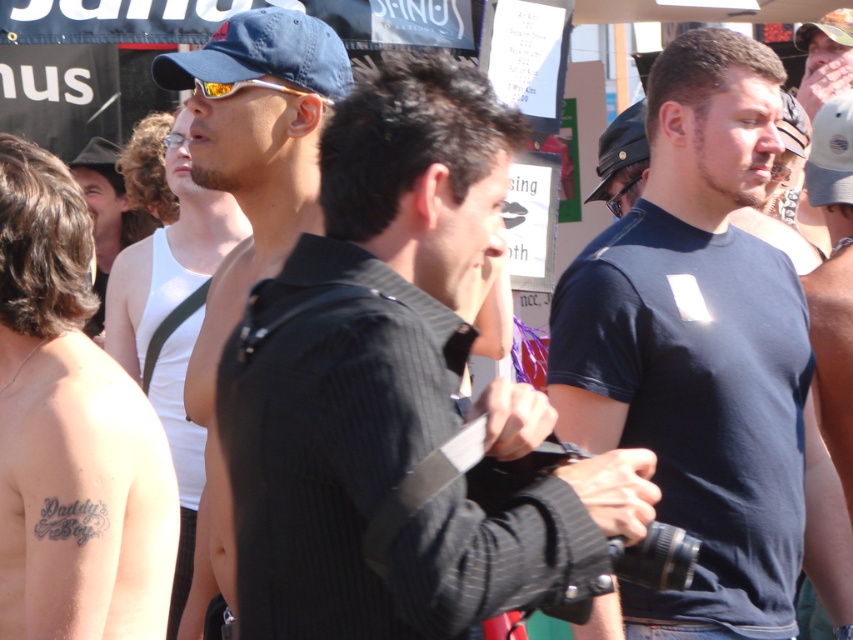
Is dark blue t-shirt at center positioned in front of matte black tank top at center?

Yes, it is in front of matte black tank top at center.

In the scene shown: Who is more distant from viewer, (738, 45) or (204, 262)?

The point (204, 262) is more distant.

Where is `dark blue t-shirt at center`? Image resolution: width=853 pixels, height=640 pixels. dark blue t-shirt at center is located at coordinates (704, 355).

Between point (21, 496) and point (251, 99), which one is positioned behind?

Point (251, 99)

Measure the distance from shiny skin tattoo at center to matte black shirt at center.

shiny skin tattoo at center is 25.62 inches from matte black shirt at center.

Image resolution: width=853 pixels, height=640 pixels. I want to click on shiny skin tattoo at center, so click(x=70, y=433).

Where is `shiny skin tattoo at center`? This screenshot has width=853, height=640. shiny skin tattoo at center is located at coordinates (70, 433).

Does black pinstripe shirt at center have a smaller size compared to matte black tank top at center?

Yes, black pinstripe shirt at center is smaller than matte black tank top at center.

Between black pinstripe shirt at center and matte black tank top at center, which one is positioned higher?

black pinstripe shirt at center is higher up.

The height and width of the screenshot is (640, 853). Identify the location of black pinstripe shirt at center. (393, 388).